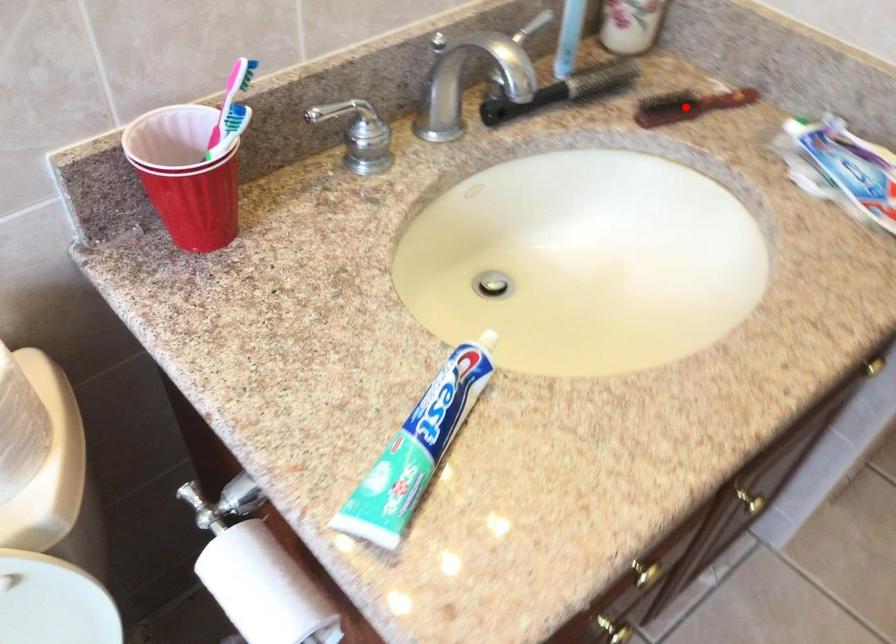
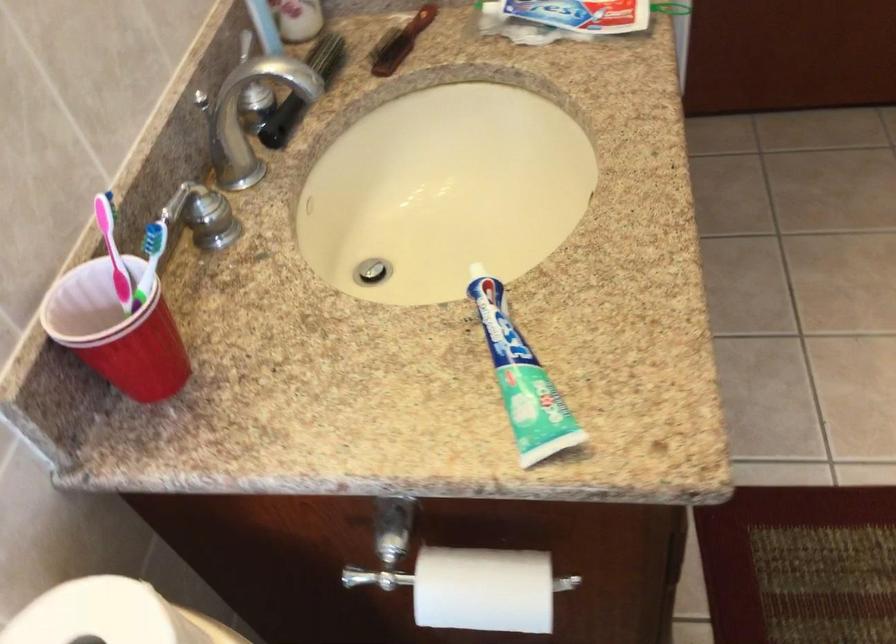
Question: I am providing you with two images of the same scene from different viewpoints. A red point is shown in image1. For the corresponding object point in image2, is it positioned nearer or farther from the camera?

Choices:
 (A) Nearer
 (B) Farther

Answer: (B)